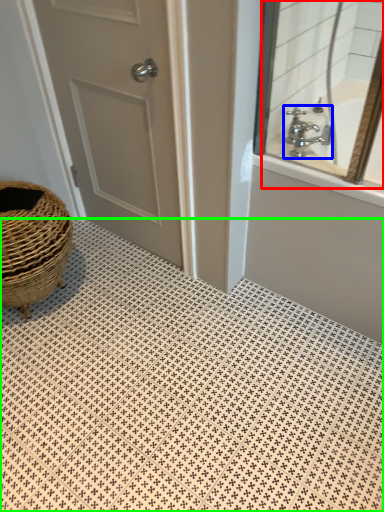
Question: Estimate the real-world distances between objects in this image. Which object is farther from mirror (highlighted by a red box), tap (highlighted by a blue box) or pattern (highlighted by a green box)?

Choices:
 (A) tap
 (B) pattern

Answer: (B)